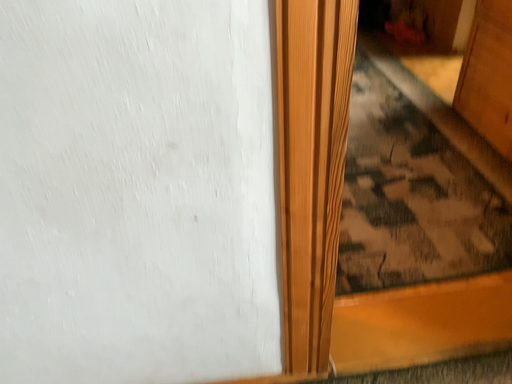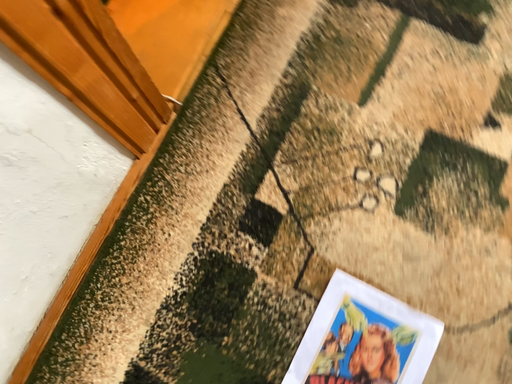
Question: How did the camera likely rotate when shooting the video?

Choices:
 (A) rotated downward
 (B) rotated upward

Answer: (A)